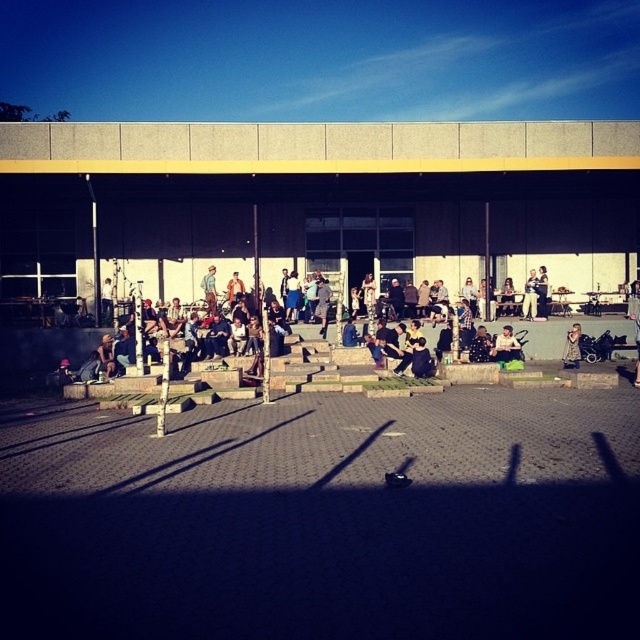
Question: Is matte black jacket at center positioned before denim jacket at lower right?

Choices:
 (A) yes
 (B) no

Answer: (A)

Question: Does matte black jacket at center appear on the left side of denim jacket at lower right?

Choices:
 (A) no
 (B) yes

Answer: (B)

Question: Which point is farther to the camera?

Choices:
 (A) denim jacket at lower right
 (B) matte black jacket at center

Answer: (A)

Question: Which point is closer to the camera?

Choices:
 (A) denim jacket at lower right
 (B) matte black jacket at center

Answer: (B)

Question: Can you confirm if matte black jacket at center is positioned above denim jacket at lower right?

Choices:
 (A) yes
 (B) no

Answer: (B)